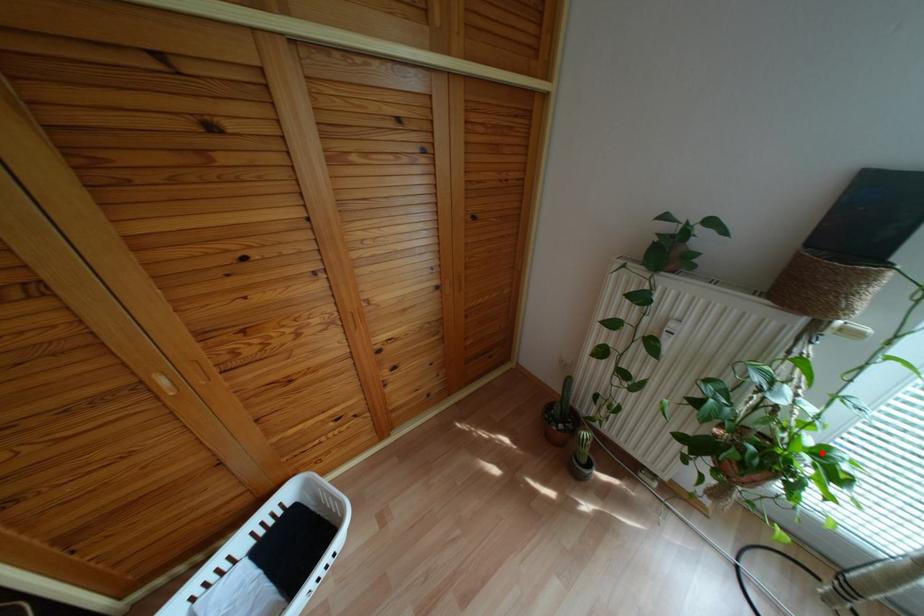
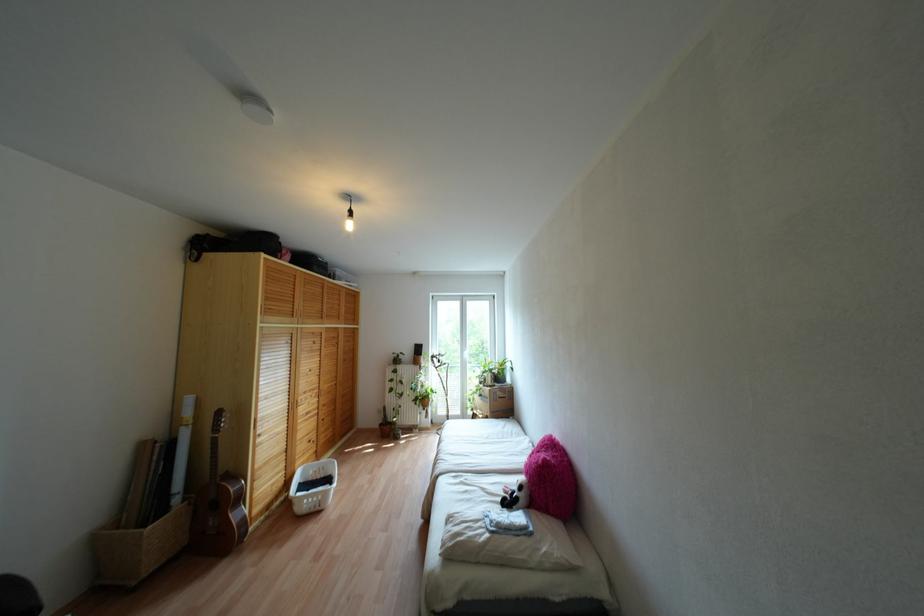
In the second image, find the point that corresponds to the highlighted location in the first image.

(431, 389)